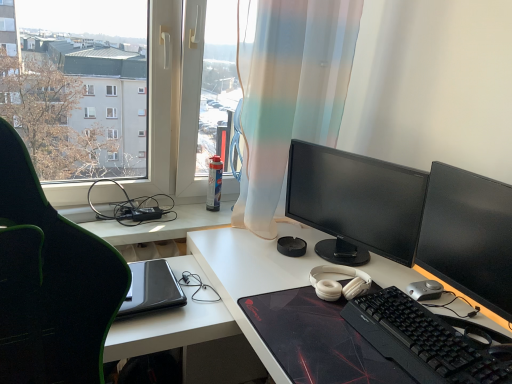
Locate an element on the screen. The width and height of the screenshot is (512, 384). free spot below translucent fabric curtain at center (from a real-world perspective) is located at coordinates (232, 235).